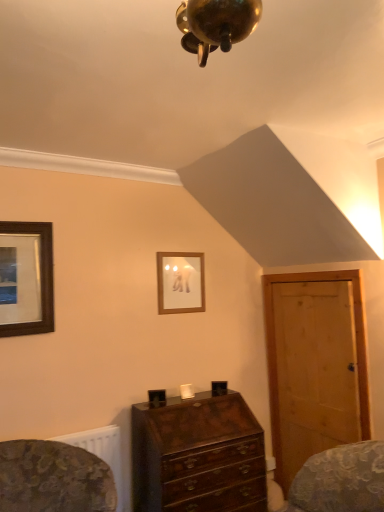
Question: Can you confirm if mahogany wooden chest of drawers at center is bigger than light brown wooden door at right?

Choices:
 (A) yes
 (B) no

Answer: (A)

Question: Considering the relative positions of mahogany wooden chest of drawers at center and light brown wooden door at right in the image provided, is mahogany wooden chest of drawers at center to the right of light brown wooden door at right from the viewer's perspective?

Choices:
 (A) no
 (B) yes

Answer: (A)

Question: From the image's perspective, is mahogany wooden chest of drawers at center located beneath light brown wooden door at right?

Choices:
 (A) no
 (B) yes

Answer: (B)

Question: Is mahogany wooden chest of drawers at center directly adjacent to light brown wooden door at right?

Choices:
 (A) yes
 (B) no

Answer: (B)

Question: Does mahogany wooden chest of drawers at center lie behind light brown wooden door at right?

Choices:
 (A) yes
 (B) no

Answer: (B)

Question: Does mahogany wooden chest of drawers at center have a lesser height compared to light brown wooden door at right?

Choices:
 (A) yes
 (B) no

Answer: (A)

Question: Would you say wooden picture frame at upper center, the second picture frame in the front-to-back sequence, contains light brown wooden door at right?

Choices:
 (A) no
 (B) yes

Answer: (A)

Question: Is wooden picture frame at upper center, the second picture frame viewed from the left, positioned behind light brown wooden door at right?

Choices:
 (A) no
 (B) yes

Answer: (B)

Question: Can you confirm if wooden picture frame at upper center, the second picture frame viewed from the left, is shorter than light brown wooden door at right?

Choices:
 (A) yes
 (B) no

Answer: (A)

Question: Is wooden picture frame at upper center, the 1th picture frame viewed from the right, at the right side of light brown wooden door at right?

Choices:
 (A) yes
 (B) no

Answer: (B)

Question: Is wooden picture frame at upper center, the 1th picture frame when ordered from back to front, touching light brown wooden door at right?

Choices:
 (A) yes
 (B) no

Answer: (B)

Question: Considering the relative sizes of wooden picture frame at upper center, the second picture frame in the front-to-back sequence, and light brown wooden door at right in the image provided, is wooden picture frame at upper center, the second picture frame in the front-to-back sequence, thinner than light brown wooden door at right?

Choices:
 (A) yes
 (B) no

Answer: (A)

Question: Does wooden framed picture at left, which is the 2th picture frame from right to left, have a greater width compared to wooden picture frame at upper center, the second picture frame viewed from the left?

Choices:
 (A) yes
 (B) no

Answer: (A)